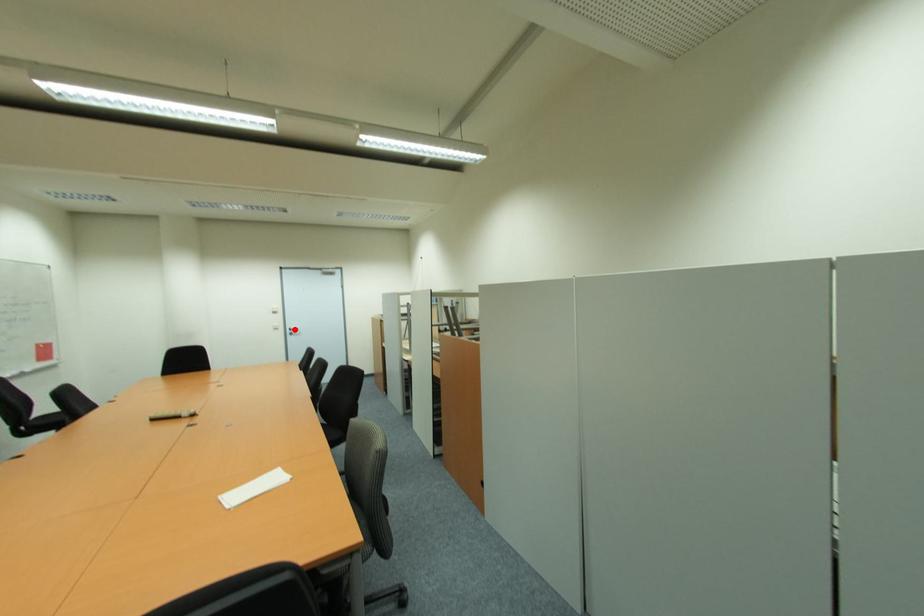
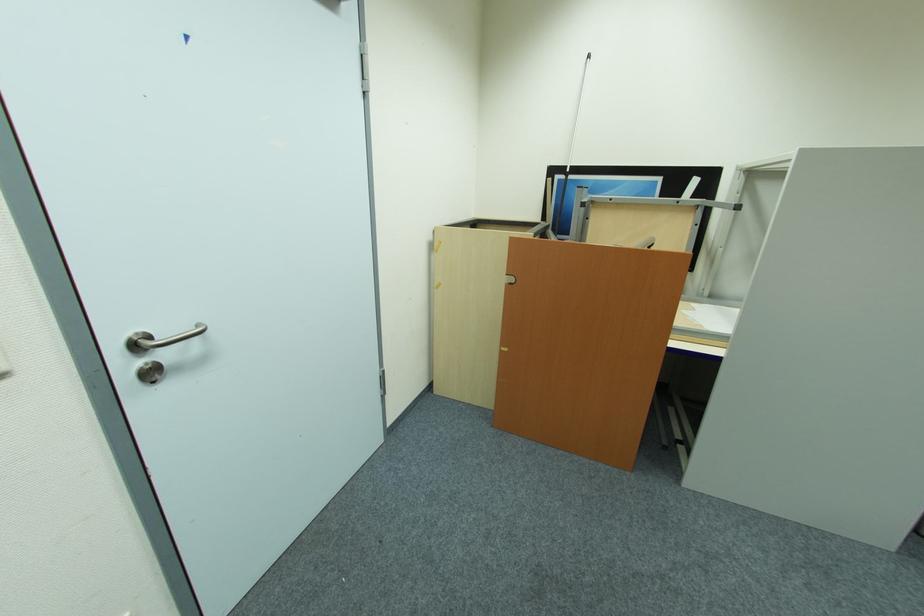
Find the pixel in the second image that matches the highlighted location in the first image.

(141, 347)